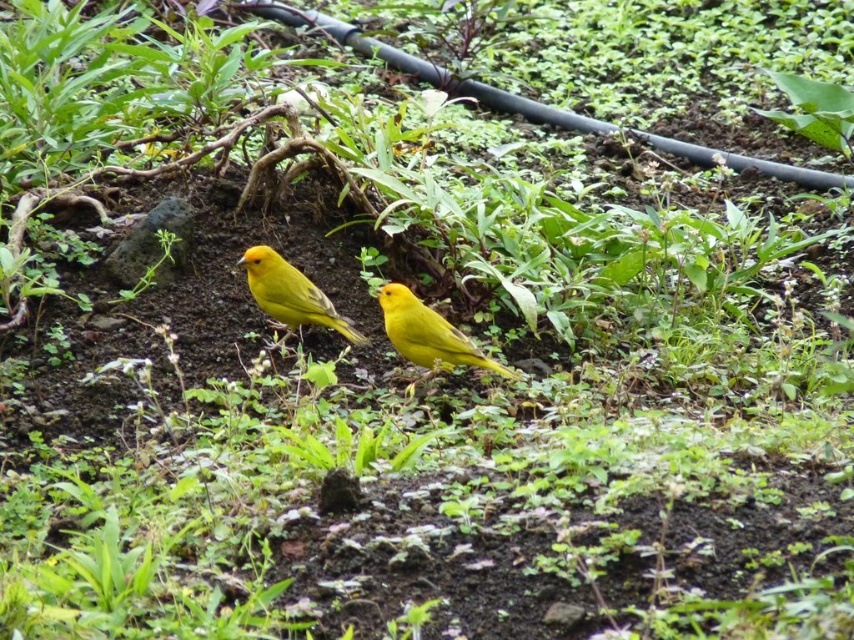
Question: Which object appears closest to the camera in this image?

Choices:
 (A) matte yellow bird at center
 (B) bright yellow bird at center

Answer: (B)

Question: Is bright yellow bird at center positioned before matte yellow bird at center?

Choices:
 (A) yes
 (B) no

Answer: (A)

Question: Can you confirm if bright yellow bird at center is smaller than matte yellow bird at center?

Choices:
 (A) no
 (B) yes

Answer: (B)

Question: Which of the following is the farthest from the observer?

Choices:
 (A) bright yellow bird at center
 (B) matte yellow bird at center

Answer: (B)

Question: Observing the image, what is the correct spatial positioning of bright yellow bird at center in reference to matte yellow bird at center?

Choices:
 (A) right
 (B) left

Answer: (A)

Question: Among these objects, which one is nearest to the camera?

Choices:
 (A) matte yellow bird at center
 (B) bright yellow bird at center

Answer: (B)